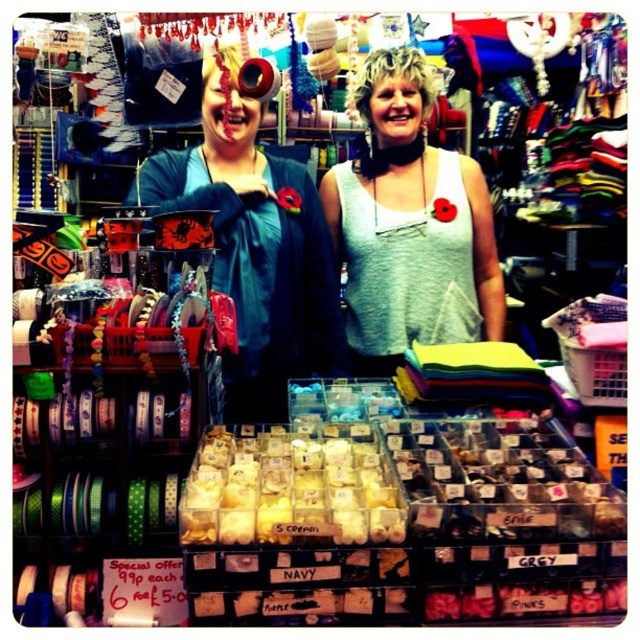
Question: From the image, what is the correct spatial relationship of blue fabric at center in relation to gray cotton tank top at center?

Choices:
 (A) above
 (B) below

Answer: (B)

Question: Can you confirm if blue fabric at center is positioned to the right of gray cotton tank top at center?

Choices:
 (A) no
 (B) yes

Answer: (A)

Question: Among these objects, which one is farthest from the camera?

Choices:
 (A) blue fabric at center
 (B) gray cotton tank top at center

Answer: (B)

Question: Which point is closer to the camera?

Choices:
 (A) gray cotton tank top at center
 (B) blue fabric at center

Answer: (B)

Question: Does blue fabric at center appear on the left side of gray cotton tank top at center?

Choices:
 (A) yes
 (B) no

Answer: (A)